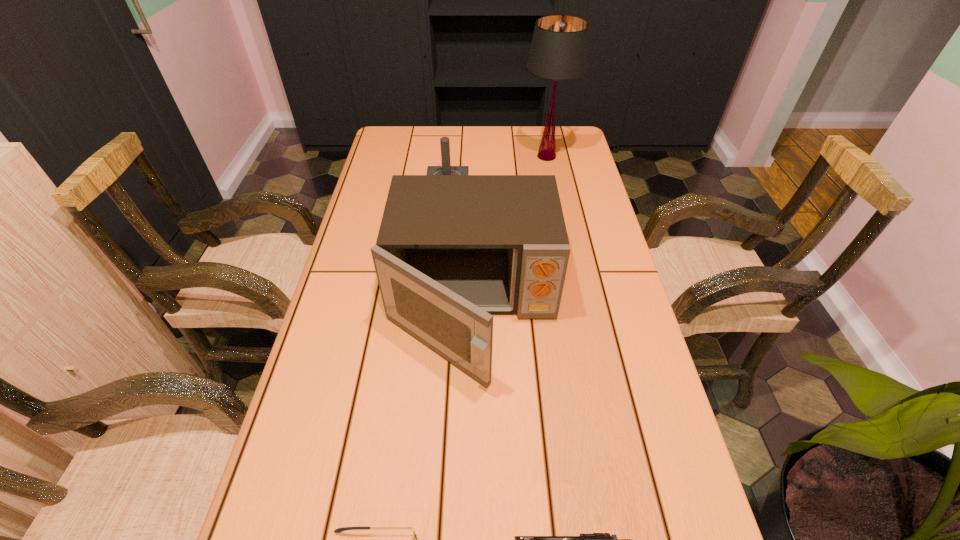
Locate an element on the screen. the farthest object is located at coordinates (559, 50).

The height and width of the screenshot is (540, 960). Find the location of `lampshade`. lampshade is located at coordinates (559, 50).

Image resolution: width=960 pixels, height=540 pixels. What are the coordinates of `the second tallest object` in the screenshot? It's located at (451, 250).

You are a GUI agent. You are given a task and a screenshot of the screen. Output one action in this format:
    pyautogui.click(x=<x>, y=<y>)
    Task: Click on the microwave oven
    
    Given the screenshot: What is the action you would take?
    pyautogui.click(x=451, y=250)

Locate an element on the screen. This screenshot has height=540, width=960. joystick is located at coordinates (446, 169).

Image resolution: width=960 pixels, height=540 pixels. In order to click on the third shortest object in this screenshot , I will do `click(446, 169)`.

The image size is (960, 540). I want to click on free region located 0.070m on the front-facing side of the tallest object, so click(500, 156).

Where is `free location located 0.050m on the front-facing side of the tallest object`? free location located 0.050m on the front-facing side of the tallest object is located at coordinates (506, 156).

Where is `free spot located on the front-facing side of the tallest object`? The image size is (960, 540). free spot located on the front-facing side of the tallest object is located at coordinates (497, 156).

Locate an element on the screen. The height and width of the screenshot is (540, 960). free region located 0.140m with the door open on the front of the third farthest object is located at coordinates (469, 461).